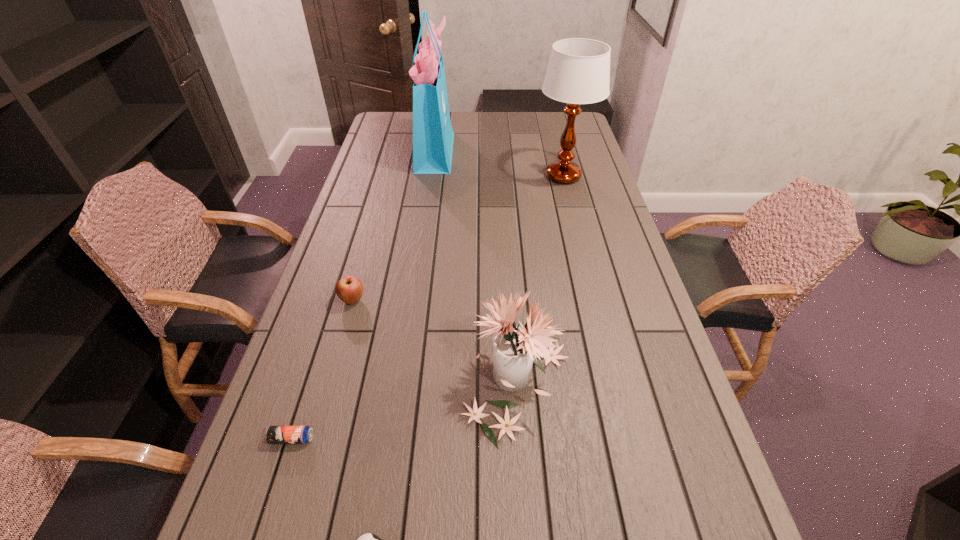
In order to click on vacant area that satisfies the following two spatial constraints: 1. on the back side of the shopping bag; 2. on the left side of the fourth tallest object in this screenshot , I will do `click(395, 151)`.